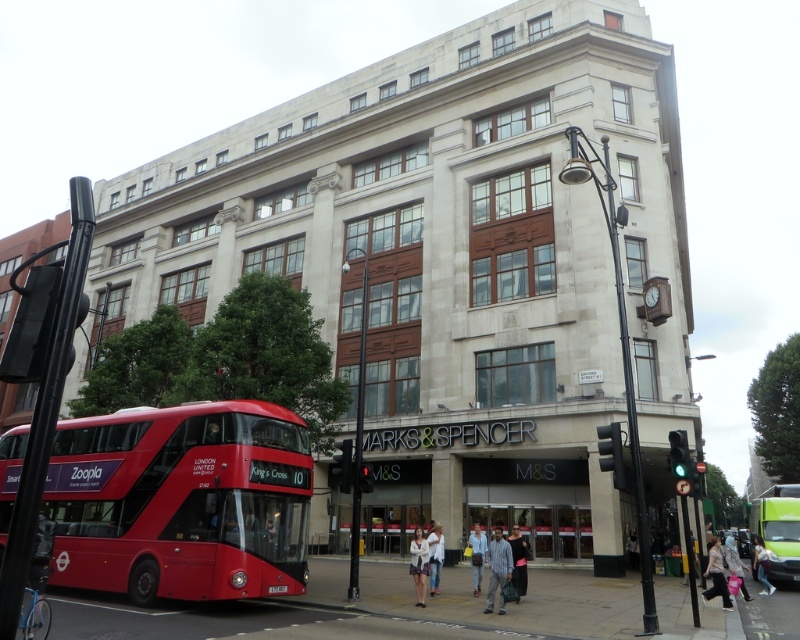
You are a delivery person who needs to place a white cotton shirt at lower right and a black fabric dress at center in a storage room. The storage room has a maximum capacity of 20 feet between any two items. Can you safely store both items without exceeding the storage room capacity?

The white cotton shirt at lower right is 16.72 feet away from the black fabric dress at center, which is within the storage room capacity of 20 feet. Therefore, you can safely store both items without exceeding the limit.

You are a customer at Marks and Spencer and want to buy a white cotton shirt at lower right and a black fabric dress at center. The store has a policy that if one item is wider than the other, you can only carry the wider one. Which item should you choose?

The white cotton shirt at lower right is wider than the black fabric dress at center, so you should choose the white cotton shirt at lower right.

You are a tourist standing at the busy street corner in front of the Marks and Spencer building. You see a red matte bus at center and a black fabric dress at center. If you want to take a photo of both objects in the same frame, will you need to zoom out your camera?

The red matte bus at center is 9.92 meters away from the black fabric dress at center. Since they are relatively close to each other, you can capture both in the same frame without needing to zoom out.